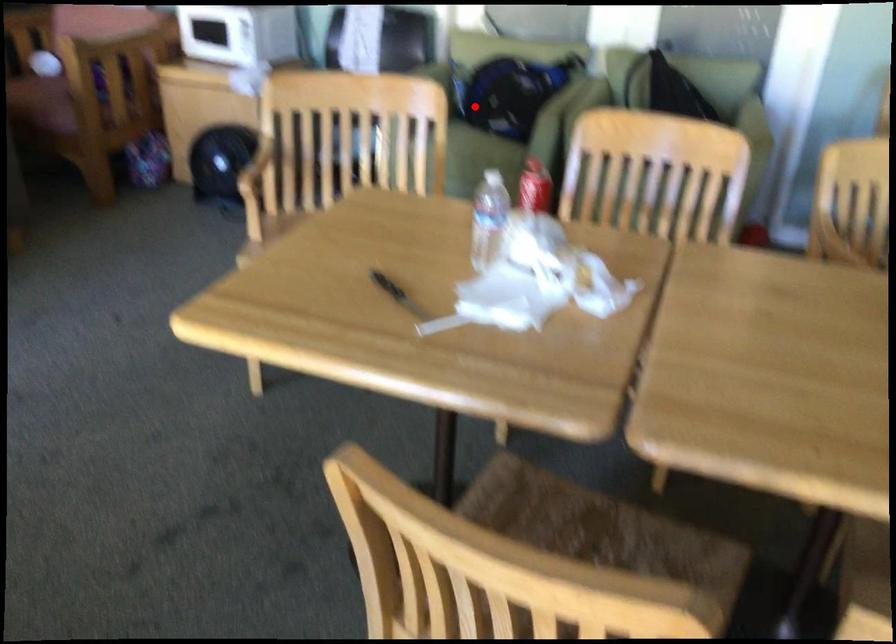
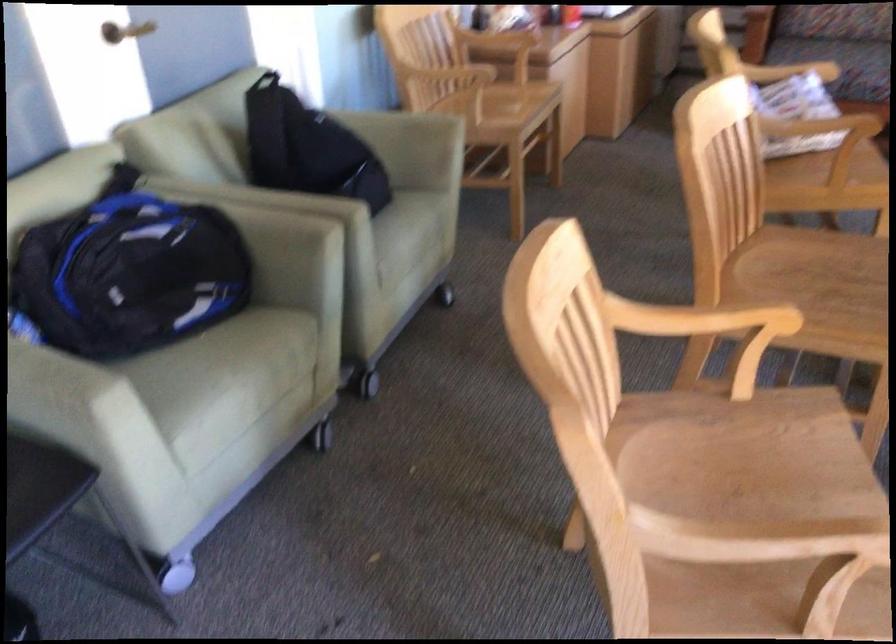
Question: A red point is marked in image1. In image2, is the corresponding 3D point closer to the camera or farther? Reply with the corresponding letter.

Choices:
 (A) The corresponding 3D point is closer.
 (B) The corresponding 3D point is farther.

Answer: (A)